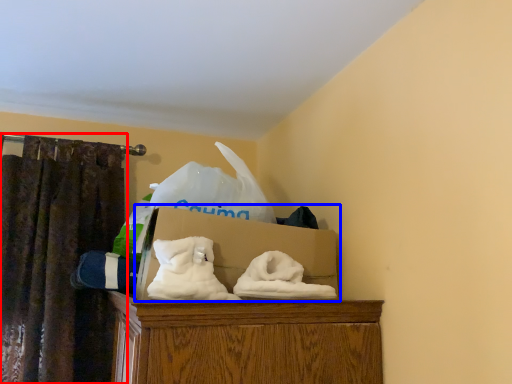
Question: Which object is further to the camera taking this photo, curtain (highlighted by a red box) or box (highlighted by a blue box)?

Choices:
 (A) curtain
 (B) box

Answer: (A)